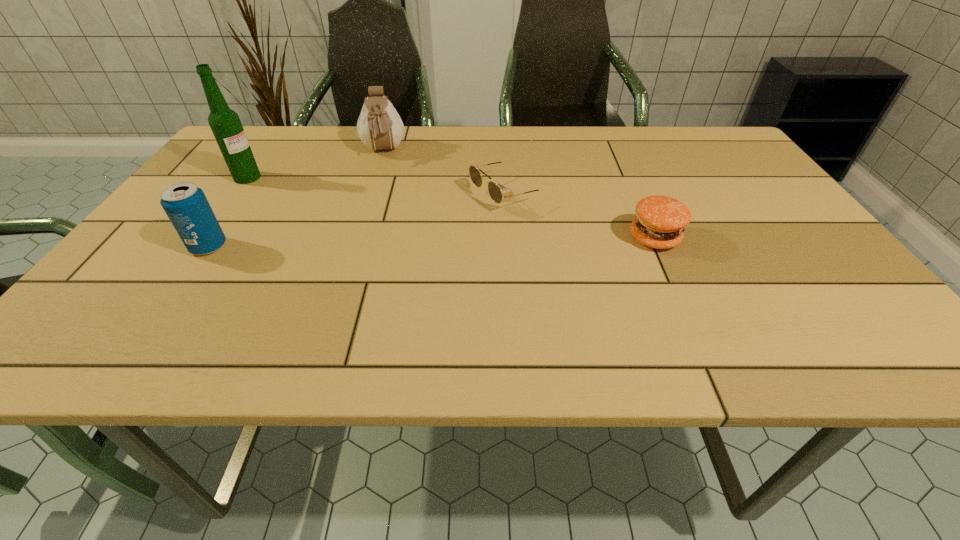
Where is `vacant region between the beer bottle and the patty`? Image resolution: width=960 pixels, height=540 pixels. vacant region between the beer bottle and the patty is located at coordinates (451, 208).

This screenshot has width=960, height=540. I want to click on vacant space that's between the sunglasses and the patty, so click(581, 215).

Find the location of a particular element. This screenshot has height=540, width=960. free space between the beer bottle and the soda can is located at coordinates (228, 212).

The width and height of the screenshot is (960, 540). Identify the location of free space between the second object from right to left and the rightmost object. pyautogui.click(x=581, y=215).

The height and width of the screenshot is (540, 960). In order to click on vacant area that lies between the fourth object from left to right and the rightmost object in this screenshot , I will do coord(581,215).

Select which object is the closest to the sunglasses. Please provide its 2D coordinates. Your answer should be formatted as a tuple, i.e. [(x, y)], where the tuple contains the x and y coordinates of a point satisfying the conditions above.

[(660, 221)]

At what (x,y) coordinates should I click in order to perform the action: click on object that ranks as the third closest to the third object from left to right. Please return your answer as a coordinate pair (x, y). This screenshot has height=540, width=960. Looking at the image, I should click on (185, 204).

At what (x,y) coordinates should I click in order to perform the action: click on free spot that satisfies the following two spatial constraints: 1. on the front side of the farthest object; 2. on the right side of the second object from right to left. Please return your answer as a coordinate pair (x, y). Image resolution: width=960 pixels, height=540 pixels. Looking at the image, I should click on (370, 193).

The height and width of the screenshot is (540, 960). Identify the location of vacant space that satisfies the following two spatial constraints: 1. on the back side of the soda can; 2. on the right side of the sunglasses. (245, 193).

You are a GUI agent. You are given a task and a screenshot of the screen. Output one action in this format:
    pyautogui.click(x=<x>, y=<y>)
    Task: Click on the free region that satisfies the following two spatial constraints: 1. on the back side of the third tallest object; 2. on the left side of the fourth object from left to right
    
    Given the screenshot: What is the action you would take?
    pyautogui.click(x=245, y=193)